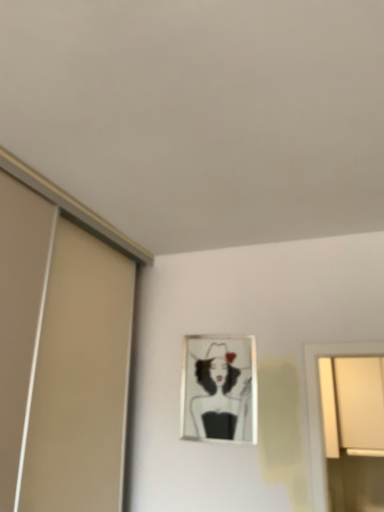
This screenshot has width=384, height=512. Describe the element at coordinates (219, 389) in the screenshot. I see `metallic silver picture frame at center` at that location.

You are a GUI agent. You are given a task and a screenshot of the screen. Output one action in this format:
    pyautogui.click(x=<x>, y=<y>)
    Task: Click on the metallic silver picture frame at center
    The height and width of the screenshot is (512, 384).
    Given the screenshot: What is the action you would take?
    pyautogui.click(x=219, y=389)

Identify the location of white matte window at upper right. The width and height of the screenshot is (384, 512). (360, 403).

Image resolution: width=384 pixels, height=512 pixels. What do you see at coordinates (360, 403) in the screenshot?
I see `white matte window at upper right` at bounding box center [360, 403].

Find the location of a particular element. metallic silver picture frame at center is located at coordinates (219, 389).

Visually, is white matte window at upper right positioned to the left or to the right of metallic silver picture frame at center?

From the image, it's evident that white matte window at upper right is to the right of metallic silver picture frame at center.

Which is behind, white matte window at upper right or metallic silver picture frame at center?

white matte window at upper right is more distant.

Considering the points (343, 369) and (197, 357), which point is behind, point (343, 369) or point (197, 357)?

The point (343, 369) is farther from the camera.

From the image's perspective, is white matte window at upper right on metallic silver picture frame at center?

Actually, white matte window at upper right appears below metallic silver picture frame at center in the image.

From a real-world perspective, which object rests below the other?

From a 3D spatial view, white matte window at upper right is below.

Is white matte window at upper right wider or thinner than metallic silver picture frame at center?

Considering their sizes, white matte window at upper right looks broader than metallic silver picture frame at center.

Who is shorter, white matte window at upper right or metallic silver picture frame at center?

With less height is metallic silver picture frame at center.

Is white matte window at upper right bigger or smaller than metallic silver picture frame at center?

white matte window at upper right is bigger than metallic silver picture frame at center.

Is metallic silver picture frame at center inside white matte window at upper right?

No, metallic silver picture frame at center is not inside white matte window at upper right.

Is white matte window at upper right directly adjacent to metallic silver picture frame at center?

white matte window at upper right and metallic silver picture frame at center are clearly separated.

Is white matte window at upper right positioned with its back to metallic silver picture frame at center?

That's not correct — white matte window at upper right is not looking away from metallic silver picture frame at center.

Can you tell me how much white matte window at upper right and metallic silver picture frame at center differ in facing direction?

0.459 degrees separate the facing orientations of white matte window at upper right and metallic silver picture frame at center.

This screenshot has width=384, height=512. Identify the location of picture frame in front of the white matte window at upper right. (219, 389).

Which is more to the right, metallic silver picture frame at center or white matte window at upper right?

white matte window at upper right.

Between metallic silver picture frame at center and white matte window at upper right, which one is positioned in front?

Positioned in front is metallic silver picture frame at center.

Is point (189, 360) positioned behind point (356, 446)?

No, it is not.

From the image's perspective, is metallic silver picture frame at center above or below white matte window at upper right?

metallic silver picture frame at center is situated higher than white matte window at upper right in the image.

From a real-world perspective, is metallic silver picture frame at center physically above white matte window at upper right?

Yes.

Which of these two, metallic silver picture frame at center or white matte window at upper right, is thinner?

Thinner between the two is metallic silver picture frame at center.

Does metallic silver picture frame at center have a lesser height compared to white matte window at upper right?

Indeed, metallic silver picture frame at center has a lesser height compared to white matte window at upper right.

Considering the sizes of objects metallic silver picture frame at center and white matte window at upper right in the image provided, who is bigger, metallic silver picture frame at center or white matte window at upper right?

With larger size is white matte window at upper right.

Is metallic silver picture frame at center located outside white matte window at upper right?

Absolutely, metallic silver picture frame at center is external to white matte window at upper right.

Would you consider metallic silver picture frame at center to be distant from white matte window at upper right?

Indeed, metallic silver picture frame at center is not near white matte window at upper right.

Does metallic silver picture frame at center turn towards white matte window at upper right?

No, metallic silver picture frame at center is not turned towards white matte window at upper right.

How many degrees apart are the facing directions of metallic silver picture frame at center and white matte window at upper right?

0.459 degrees separate the facing orientations of metallic silver picture frame at center and white matte window at upper right.

How far apart are metallic silver picture frame at center and white matte window at upper right?

metallic silver picture frame at center and white matte window at upper right are 1.84 meters apart from each other.

The height and width of the screenshot is (512, 384). What are the coordinates of `picture frame in front of the white matte window at upper right` in the screenshot? It's located at (219, 389).

This screenshot has height=512, width=384. I want to click on window on the right of metallic silver picture frame at center, so click(x=360, y=403).

Where is `window that appears behind the metallic silver picture frame at center`? window that appears behind the metallic silver picture frame at center is located at coordinates (360, 403).